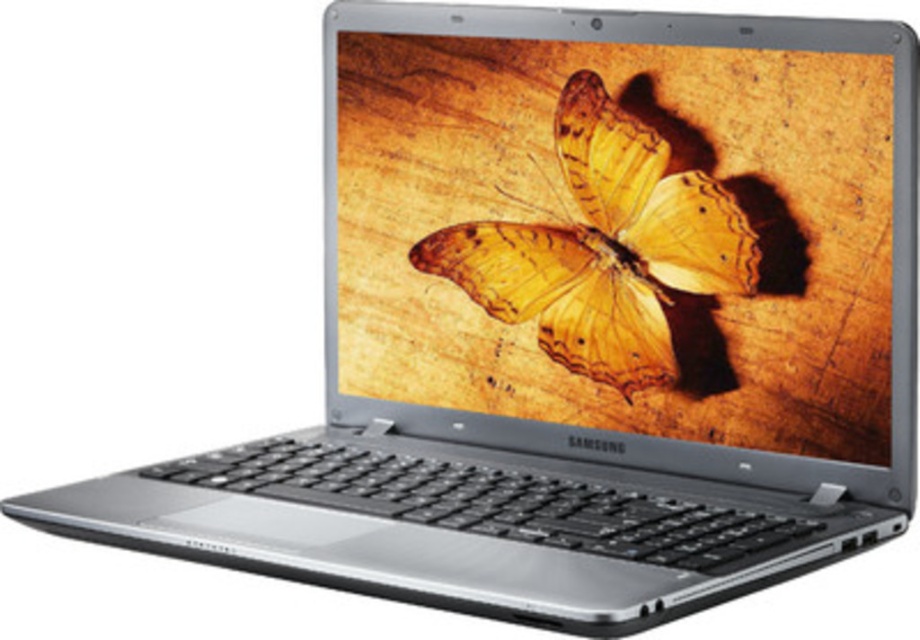
You are setting up a photography display and need to know the arrangement of the metallic silver laptop at center and the yellow translucent wings at center. Which object is placed higher in the image?

The metallic silver laptop at center is located above the yellow translucent wings at center, so it is placed higher in the image.